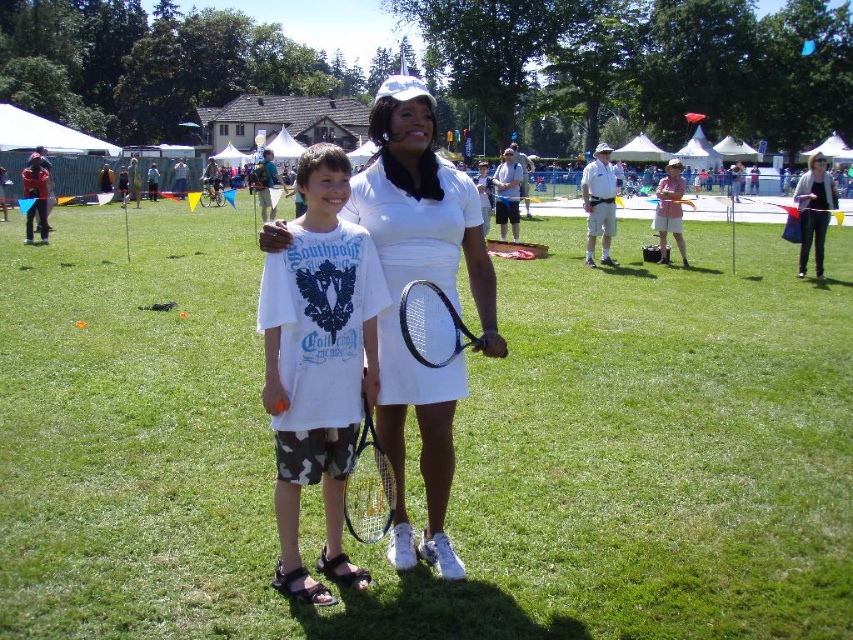
Who is taller, metallic silver tennis racket at center or white cotton dress at center?

→ With more height is white cotton dress at center.

Is point (367, 429) closer to viewer compared to point (798, 182)?

Yes, point (367, 429) is closer to viewer.

Does point (379, 492) lie behind point (815, 268)?

No, (379, 492) is in front of (815, 268).

Image resolution: width=853 pixels, height=640 pixels. What are the coordinates of `metallic silver tennis racket at center` in the screenshot? It's located at (368, 486).

Does white cotton t-shirt at center have a lesser height compared to white matte tennis dress at center?

Yes.

Does white cotton t-shirt at center have a smaller size compared to white matte tennis dress at center?

Indeed, white cotton t-shirt at center has a smaller size compared to white matte tennis dress at center.

Does point (323, 186) lie in front of point (376, 196)?

Yes, point (323, 186) is closer to viewer.

Where is `white cotton t-shirt at center`? The width and height of the screenshot is (853, 640). white cotton t-shirt at center is located at coordinates (318, 364).

Is metallic silver tennis racket at center thinner than black matte tennis racket at center?

Correct, metallic silver tennis racket at center's width is less than black matte tennis racket at center's.

In the scene shown: Between metallic silver tennis racket at center and black matte tennis racket at center, which one has more height?

metallic silver tennis racket at center

The width and height of the screenshot is (853, 640). What do you see at coordinates (368, 486) in the screenshot?
I see `metallic silver tennis racket at center` at bounding box center [368, 486].

Identify the location of metallic silver tennis racket at center. (368, 486).